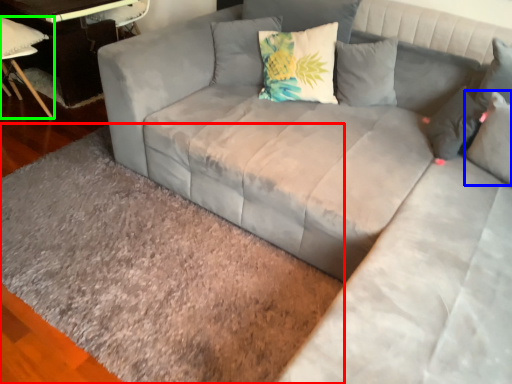
Question: Which object is the closest to the mat (highlighted by a red box)? Choose among these: pillow (highlighted by a blue box) or chair (highlighted by a green box).

Choices:
 (A) pillow
 (B) chair

Answer: (A)